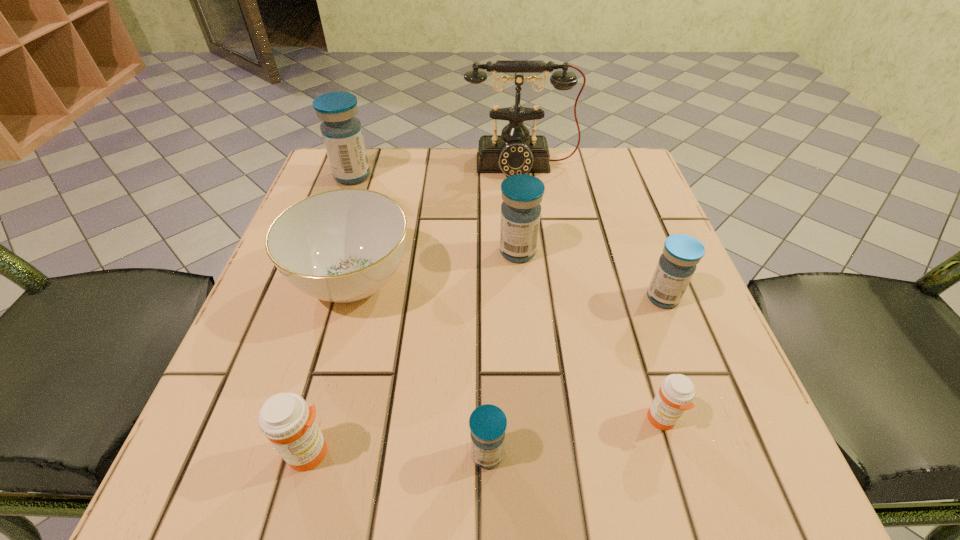
This screenshot has width=960, height=540. What are the coordinates of `the smaller orange medicine` in the screenshot? It's located at (676, 393).

Identify the location of the second medicine from right to left. This screenshot has width=960, height=540. (676, 393).

I want to click on the nearest blue medicine, so click(x=488, y=423).

Identify the location of the smallest blue medicine. (488, 423).

What are the coordinates of `blank space located on the dial of the black telephone` in the screenshot? It's located at (539, 311).

The width and height of the screenshot is (960, 540). I want to click on vacant space located 0.290m on the right of the second tallest object, so click(496, 176).

Locate an element on the screen. free region located 0.070m on the right of the sixth shortest object is located at coordinates (573, 252).

Find the location of a particular element. vacant point located 0.200m on the right of the chinaware is located at coordinates (526, 281).

In order to click on vacant area located 0.100m on the back of the third farthest medicine in this screenshot , I will do `click(643, 247)`.

Find the location of `vacant space positioned on the right of the bigger orange medicine`. vacant space positioned on the right of the bigger orange medicine is located at coordinates (570, 453).